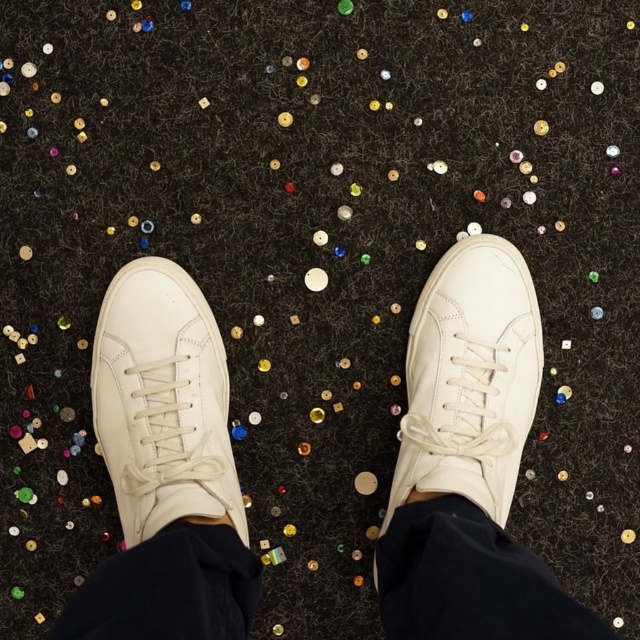
You are a photographer setting up a shoot. You notice two pairs of white leather sneakers in the scene. Which one is wider in width between the white leather sneakers at center and the white leather sneaker at left?

The white leather sneakers at center is wider in width than the white leather sneaker at left.